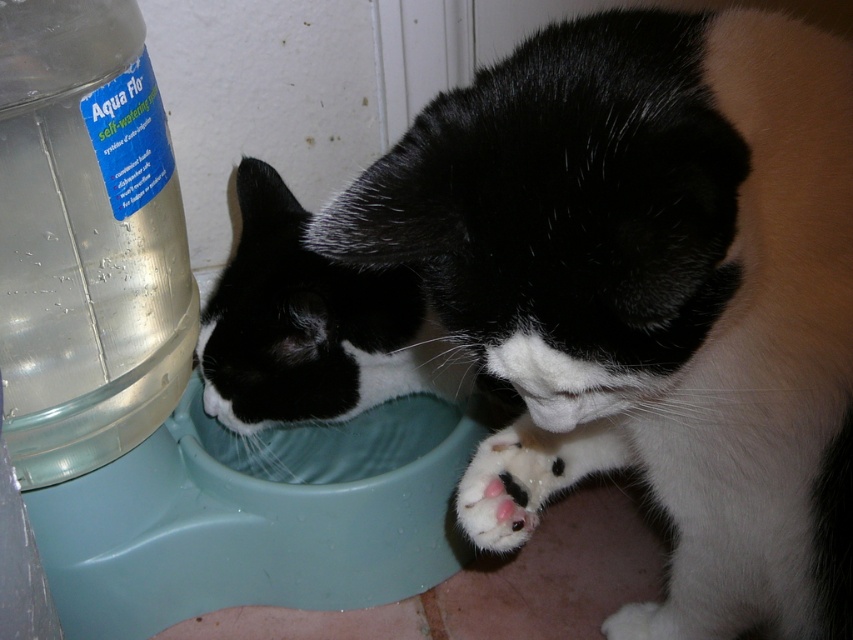
You are a cat owner who wants to ensure your cat can access the water bowl easily. Based on the scene, is the transparent plastic bottle at left blocking the white fur paw at lower center from reaching the bowl?

The transparent plastic bottle at left is in front of the white fur paw at lower center, so it is blocking the paw from reaching the bowl. Move the bottle to give the cat more space.

You are a cat owner who wants to ensure your cat can easily access its water. The cat is standing near the white fur paw at lower center. The Aqua Flo system has a transparent plastic bottle at left that needs to be refilled. If the cat is 12 inches tall, can it reach the water in the bowl without needing to jump?

The distance between the transparent plastic bottle at left and the white fur paw at lower center is 20.24 inches. Since the cat is 12 inches tall, it would need to jump or stretch to reach the bottle, but the question mentions the bowl, not the bottle. The bowl is part of the Aqua Flo system and attached to the bottle, so the cat can likely reach the bowl without jumping as it is positioned within its reach.